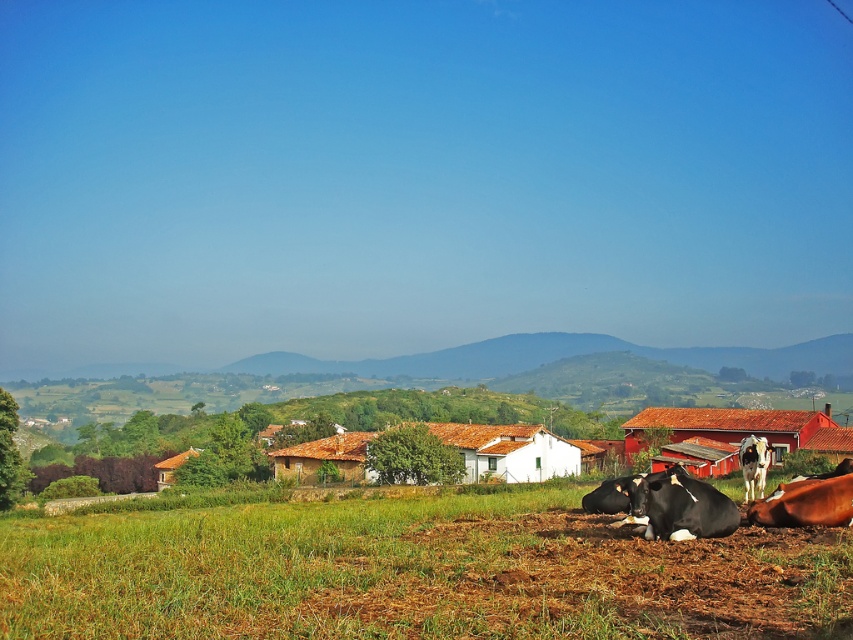
Where is `black glossy cow at lower center`? The height and width of the screenshot is (640, 853). black glossy cow at lower center is located at coordinates (679, 506).

How much distance is there between black glossy cow at lower center and white glossy cow at lower right?

black glossy cow at lower center and white glossy cow at lower right are 6.32 meters apart.

The image size is (853, 640). I want to click on black glossy cow at lower center, so click(x=679, y=506).

Who is positioned more to the right, green grass at lower left or brown glossy cow at lower right?

brown glossy cow at lower right is more to the right.

Between green grass at lower left and brown glossy cow at lower right, which one is positioned lower?

green grass at lower left

Is point (335, 561) in front of point (799, 500)?

Yes, point (335, 561) is closer to viewer.

Locate an element on the screen. Image resolution: width=853 pixels, height=640 pixels. green grass at lower left is located at coordinates (413, 572).

Which is below, black glossy cow at lower center or brown glossy cow at lower right?

Positioned lower is brown glossy cow at lower right.

Can you confirm if black glossy cow at lower center is thinner than brown glossy cow at lower right?

Yes.

The height and width of the screenshot is (640, 853). What do you see at coordinates (679, 506) in the screenshot? I see `black glossy cow at lower center` at bounding box center [679, 506].

The height and width of the screenshot is (640, 853). What are the coordinates of `black glossy cow at lower center` in the screenshot? It's located at (679, 506).